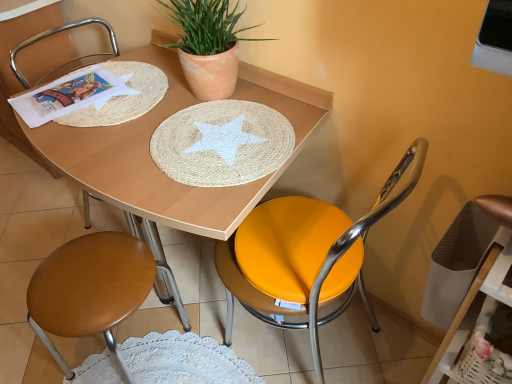
Find the location of a particular element. The height and width of the screenshot is (384, 512). blank area beneath matte terracotta pot at upper center (from a real-world perspective) is located at coordinates (209, 98).